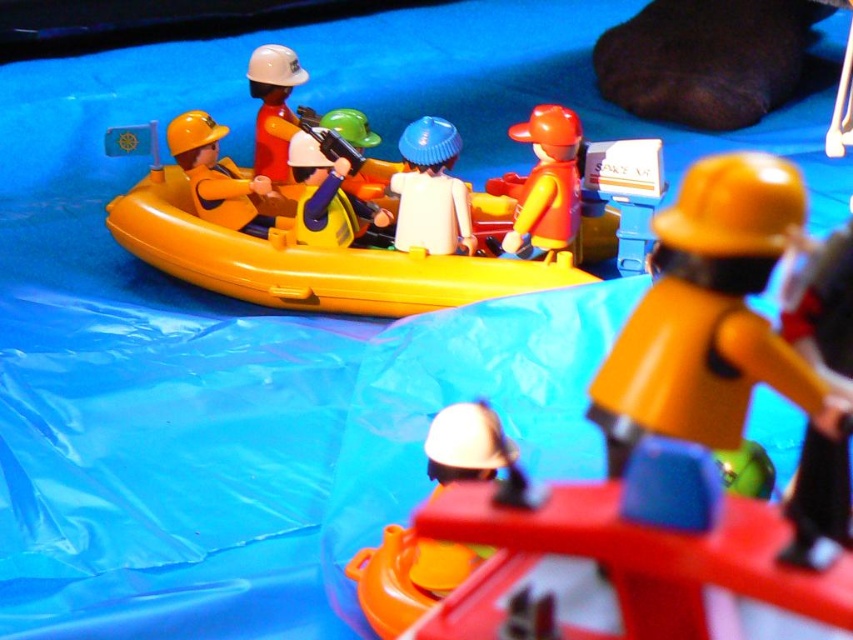
Question: Is matte yellow helmet at center positioned before matte yellow helmet at left?

Choices:
 (A) yes
 (B) no

Answer: (A)

Question: Which of these objects is positioned closest to the white matte figure at center?

Choices:
 (A) matte yellow helmet at left
 (B) yellow rubber boat at center
 (C) matte yellow helmet at center

Answer: (B)

Question: Which object is closer to the camera taking this photo?

Choices:
 (A) white matte figure at center
 (B) matte white helmet at upper center
 (C) yellow rubber boat at center

Answer: (C)

Question: Based on their relative distances, which object is farther from the matte yellow helmet at center?

Choices:
 (A) white matte figure at center
 (B) white matte helmet at lower center

Answer: (A)

Question: From the image, what is the correct spatial relationship of matte yellow helmet at center in relation to rubberized red life vest at center?

Choices:
 (A) left
 (B) right

Answer: (B)

Question: Does matte yellow helmet at left appear on the right side of matte white helmet at upper center?

Choices:
 (A) yes
 (B) no

Answer: (B)